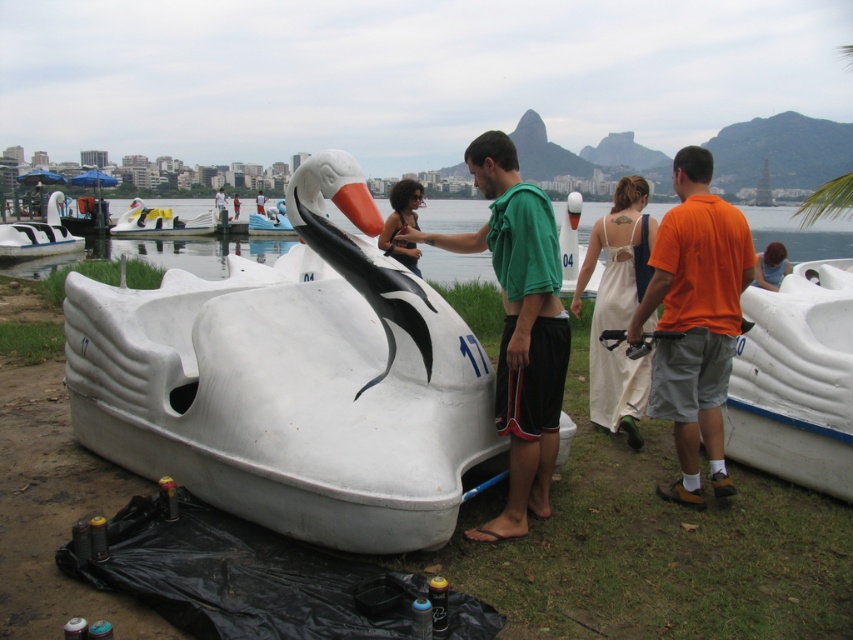
Question: Which object is positioned closest to the orange fabric shirt at center?

Choices:
 (A) white satin dress at center
 (B) white plastic swan at center
 (C) white matte swan boat at right
 (D) white plastic swan at left

Answer: (A)

Question: Does white matte swan boat at right have a lesser width compared to dark brown hair at center?

Choices:
 (A) no
 (B) yes

Answer: (A)

Question: From the image, what is the correct spatial relationship of orange cotton shirt at right in relation to white plastic swan at left?

Choices:
 (A) above
 (B) below

Answer: (B)

Question: Estimate the real-world distances between objects in this image. Which object is closer to the green matte shirt at center?

Choices:
 (A) white matte swan boat at center
 (B) white plastic swan at left

Answer: (B)

Question: Considering the relative positions of white plastic swan at center and orange fabric shirt at center in the image provided, where is white plastic swan at center located with respect to orange fabric shirt at center?

Choices:
 (A) below
 (B) above

Answer: (A)

Question: Which point is farther to the camera?

Choices:
 (A) (848, 326)
 (B) (33, 244)
 (C) (776, 275)

Answer: (B)